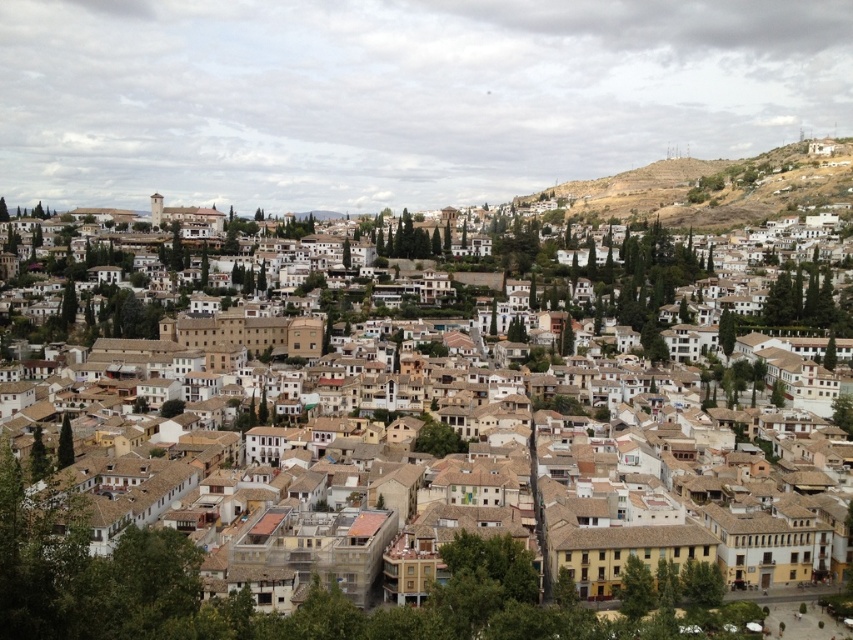
You are standing in the middle of the historic town and see two points marked on the ground, one at point coordinates point (418, 618) and the other at point coordinates point (598, 188). Which point is closer to you?

Point (418, 618) is closer to the viewer than point (598, 188).

You are standing in the middle of the urban area and want to take a photo of the brown clay roof tiles at center and the brown rocky hillside at upper right. Which object should you focus on first to ensure both are in the frame?

You should focus on the brown clay roof tiles at center first because it is closer to you than the brown rocky hillside at upper right, so adjusting the camera to include both would require starting with the closer object.